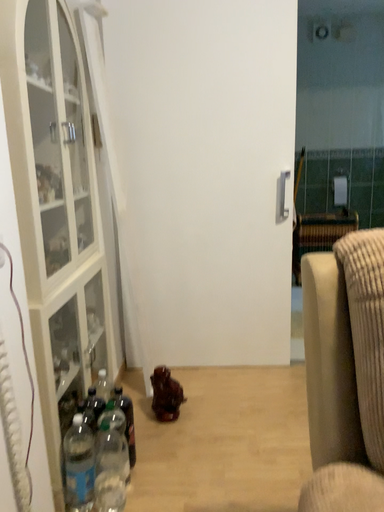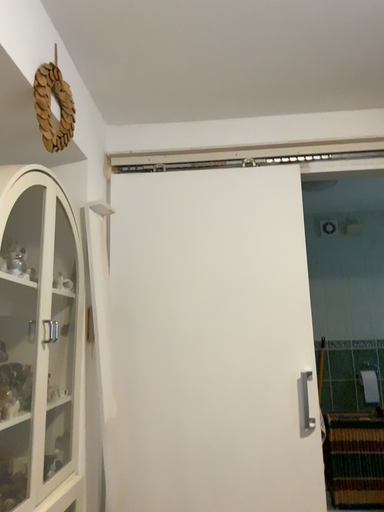
Question: Which way did the camera rotate in the video?

Choices:
 (A) rotated downward
 (B) rotated upward

Answer: (B)